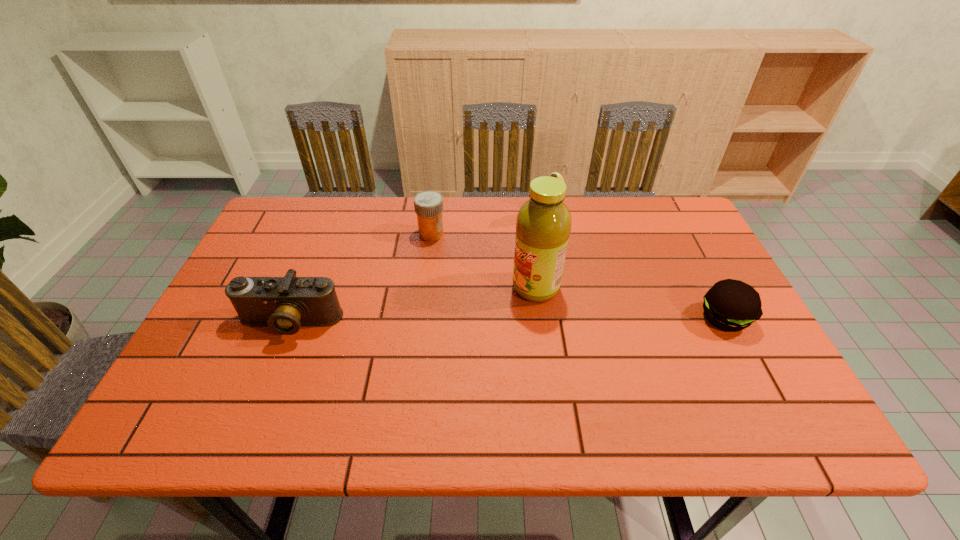
The width and height of the screenshot is (960, 540). In order to click on vacant region located 0.170m from the stem of the second tallest object in this screenshot , I will do `click(521, 268)`.

At what (x,y) coordinates should I click in order to perform the action: click on free space located 0.070m on the front label of the fruit juice. Please return your answer as a coordinate pair (x, y). Looking at the image, I should click on (494, 308).

Find the location of `vacant point located 0.350m on the front label of the fruit juice`. vacant point located 0.350m on the front label of the fruit juice is located at coordinates (394, 360).

I want to click on vacant region located on the front label of the fruit juice, so click(x=428, y=342).

Identify the location of free space located on the label side of the second object from left to right. Image resolution: width=960 pixels, height=540 pixels. (487, 277).

At what (x,y) coordinates should I click in order to perform the action: click on free location located 0.060m on the label side of the second object from left to right. Please return your answer as a coordinate pair (x, y). Image resolution: width=960 pixels, height=540 pixels. Looking at the image, I should click on (452, 250).

The height and width of the screenshot is (540, 960). Identify the location of free space located 0.070m on the label side of the second object from left to right. (454, 252).

The height and width of the screenshot is (540, 960). Identify the location of banana present at the far edge. (554, 174).

Identify the location of medicine located at the far edge. (428, 205).

This screenshot has height=540, width=960. What are the coordinates of `object that is at the left edge` in the screenshot? It's located at (284, 304).